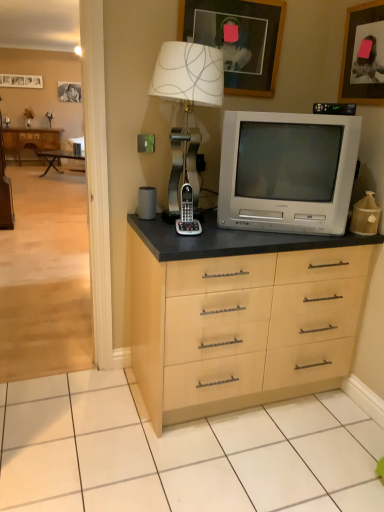
Find the location of a particular element. This screenshot has height=512, width=384. matte gray speaker at left is located at coordinates (147, 202).

This screenshot has width=384, height=512. What are the coordinates of `silver metallic television at center` in the screenshot? It's located at (287, 170).

You are a GUI agent. You are given a task and a screenshot of the screen. Output one action in this format:
    pyautogui.click(x=<x>, y=<y>)
    Task: Click on the satin silver table lamp at upper center
    
    Given the screenshot: What is the action you would take?
    pyautogui.click(x=187, y=104)

The height and width of the screenshot is (512, 384). What do you see at coordinates (21, 81) in the screenshot? I see `wooden photo frame at upper left, positioned as the 1th picture frame in back-to-front order` at bounding box center [21, 81].

Where is `light wood floor at left`? light wood floor at left is located at coordinates (45, 278).

In terms of size, does gray plastic phone at center appear bigger or smaller than silver metallic television at center?

Considering their sizes, gray plastic phone at center takes up less space than silver metallic television at center.

Is gray plastic phone at center next to silver metallic television at center?

gray plastic phone at center is not next to silver metallic television at center, and they're not touching.

Based on the photo, from the image's perspective, does gray plastic phone at center appear higher than silver metallic television at center?

Incorrect, from the image's perspective, gray plastic phone at center is lower than silver metallic television at center.

Is gray plastic phone at center behind silver metallic television at center?

Yes.

Is gray plastic phone at center taller or shorter than wooden picture frame at upper right, which is the third picture frame from left to right?

Clearly, gray plastic phone at center is shorter compared to wooden picture frame at upper right, which is the third picture frame from left to right.

In the scene shown: From the image's perspective, which is above, gray plastic phone at center or wooden picture frame at upper right, which ranks as the first picture frame in right-to-left order?

wooden picture frame at upper right, which ranks as the first picture frame in right-to-left order.

From a real-world perspective, is gray plastic phone at center on wooden picture frame at upper right, marked as the third picture frame in a back-to-front arrangement?

No.

Is gray plastic phone at center not close to wooden picture frame at upper right, the 1th picture frame in the front-to-back sequence?

No, gray plastic phone at center is not far from wooden picture frame at upper right, the 1th picture frame in the front-to-back sequence.

Could you tell me if silver metallic television at center is facing matte gray speaker at left?

No, silver metallic television at center is not turned towards matte gray speaker at left.

Is silver metallic television at center inside the boundaries of matte gray speaker at left, or outside?

silver metallic television at center is not inside matte gray speaker at left, it's outside.

Which of these two, silver metallic television at center or matte gray speaker at left, stands shorter?

Standing shorter between the two is matte gray speaker at left.

Considering the sizes of objects silver metallic television at center and matte gray speaker at left in the image provided, who is thinner, silver metallic television at center or matte gray speaker at left?

matte gray speaker at left is thinner.

Is wooden picture frame at upper center, placed as the second picture frame when sorted from top to bottom, not near gray plastic phone at center?

No, wooden picture frame at upper center, placed as the second picture frame when sorted from top to bottom, is not far away from gray plastic phone at center.

Is wooden picture frame at upper center, which appears as the second picture frame when viewed from the back, aimed at gray plastic phone at center?

No.

This screenshot has height=512, width=384. I want to click on the 2nd picture frame directly above the gray plastic phone at center (from a real-world perspective), so click(238, 39).

Would you say gray plastic phone at center is part of wooden picture frame at upper center, the second picture frame from the left,'s contents?

No, gray plastic phone at center is not surrounded by wooden picture frame at upper center, the second picture frame from the left.

Where is `picture frame on the left of satin silver table lamp at upper center`? This screenshot has width=384, height=512. picture frame on the left of satin silver table lamp at upper center is located at coordinates (21, 81).

From the image's perspective, would you say satin silver table lamp at upper center is shown under wooden photo frame at upper left, the third picture frame from the bottom?

Yes.

Is satin silver table lamp at upper center positioned with its back to wooden photo frame at upper left, the third picture frame positioned from the front?

Yes, wooden photo frame at upper left, the third picture frame positioned from the front, is at the back of satin silver table lamp at upper center.

Is satin silver table lamp at upper center further to camera compared to wooden photo frame at upper left, marked as the 1th picture frame in a top-to-bottom arrangement?

That is False.

Is gray plastic phone at center bigger than wooden picture frame at upper center, placed as the second picture frame when sorted from top to bottom?

No.

Are gray plastic phone at center and wooden picture frame at upper center, placed as the second picture frame when sorted from top to bottom, located far from each other?

That's not correct — gray plastic phone at center is a little close to wooden picture frame at upper center, placed as the second picture frame when sorted from top to bottom.

From the image's perspective, is gray plastic phone at center under wooden picture frame at upper center, the second picture frame from the left?

Correct, gray plastic phone at center appears lower than wooden picture frame at upper center, the second picture frame from the left, in the image.

Is gray plastic phone at center in front of wooden picture frame at upper center, the second picture frame from the left?

Yes.

From the image's perspective, which object appears higher, light wood floor at left or brown wood desk at left?

brown wood desk at left.

In order to click on corridor below the brown wood desk at left (from the image's perspective) in this screenshot , I will do `click(45, 278)`.

Can you tell me how much light wood floor at left and brown wood desk at left differ in facing direction?

The facing directions of light wood floor at left and brown wood desk at left are 3.28 degrees apart.

Does light wood floor at left have a smaller size compared to brown wood desk at left?

Yes, light wood floor at left is smaller than brown wood desk at left.

Find the location of `television in front of the gray plastic phone at center`. television in front of the gray plastic phone at center is located at coordinates (287, 170).

The height and width of the screenshot is (512, 384). Identify the location of appliance located underneath the wooden picture frame at upper right, which ranks as the first picture frame in right-to-left order (from a real-world perspective). (187, 214).

From the image, which object appears to be nearer to matte gray speaker at left, wooden picture frame at upper center, placed as the second picture frame when sorted from top to bottom, or gray plastic phone at center?

Based on the image, gray plastic phone at center appears to be nearer to matte gray speaker at left.

Estimate the real-world distances between objects in this image. Which object is closer to gray plastic phone at center, matte gray speaker at left or wooden photo frame at upper left, which is the third picture frame in right-to-left order?

matte gray speaker at left is positioned closer to the anchor gray plastic phone at center.

Based on their spatial positions, is wooden photo frame at upper left, the third picture frame positioned from the front, or gray plastic phone at center further from brown wood desk at left?

The object further to brown wood desk at left is gray plastic phone at center.

From the image, which object appears to be nearer to brown wood desk at left, gray plastic phone at center or silver metallic television at center?

The object closer to brown wood desk at left is gray plastic phone at center.

Looking at the image, which one is located further to brown wood desk at left, gray plastic phone at center or matte gray speaker at left?

Based on the image, gray plastic phone at center appears to be further to brown wood desk at left.

Looking at the image, which one is located further to silver metallic television at center, matte gray speaker at left or wooden picture frame at upper center, acting as the second picture frame starting from the bottom?

The object further to silver metallic television at center is matte gray speaker at left.

Looking at the image, which one is located further to wooden picture frame at upper right, acting as the 3th picture frame starting from the top, light wood floor at left or matte gray speaker at left?

Based on the image, light wood floor at left appears to be further to wooden picture frame at upper right, acting as the 3th picture frame starting from the top.

Based on their spatial positions, is light wood floor at left or gray plastic phone at center closer to wooden picture frame at upper center, which appears as the second picture frame when viewed from the back?

gray plastic phone at center is positioned closer to the anchor wooden picture frame at upper center, which appears as the second picture frame when viewed from the back.

Find the location of a particular element. desk between wooden picture frame at upper right, which is the third picture frame from left to right, and wooden photo frame at upper left, the third picture frame from the bottom, from front to back is located at coordinates (30, 140).

Identify the location of appliance between satin silver table lamp at upper center and wooden picture frame at upper right, which ranks as the first picture frame in right-to-left order, from left to right. This screenshot has height=512, width=384. (187, 214).

Image resolution: width=384 pixels, height=512 pixels. In order to click on television positioned between light wood floor at left and wooden photo frame at upper left, positioned as the 1th picture frame in back-to-front order, from near to far in this screenshot , I will do `click(287, 170)`.

What are the coordinates of `picture frame located between matte gray speaker at left and wooden picture frame at upper right, the first picture frame ordered from the bottom, in the left-right direction` in the screenshot? It's located at (238, 39).